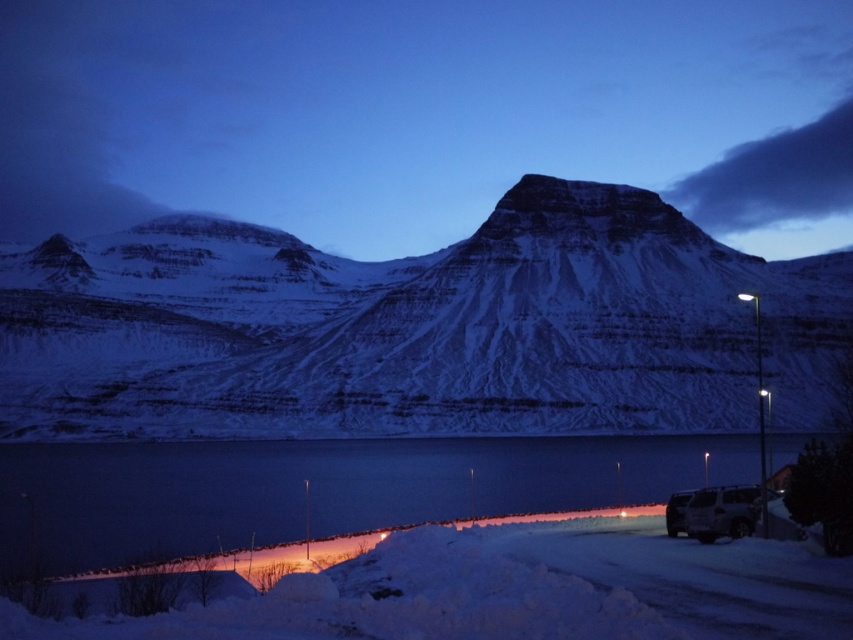
Is smooth ice lake at lower center further to the viewer compared to silver metallic van at lower right?

No, smooth ice lake at lower center is closer to the viewer.

Which is above, smooth ice lake at lower center or silver metallic van at lower right?

Positioned higher is smooth ice lake at lower center.

Who is more forward, [653,476] or [751,529]?

Point [751,529] is in front.

Locate an element on the screen. smooth ice lake at lower center is located at coordinates (318, 486).

Is snowy mountain at center wider than white powdery snow at lower center?

Yes.

Between snowy mountain at center and white powdery snow at lower center, which one is positioned lower?

Positioned lower is white powdery snow at lower center.

Identify the location of snowy mountain at center. (424, 115).

Identify the location of snowy mountain at center. The width and height of the screenshot is (853, 640). (424, 115).

Is white snow-covered mountain at center to the right of white powdery snow at lower center from the viewer's perspective?

No, white snow-covered mountain at center is not to the right of white powdery snow at lower center.

Between point (477, 349) and point (543, 532), which one is positioned in front?

Point (543, 532) is more forward.

The width and height of the screenshot is (853, 640). Describe the element at coordinates (415, 328) in the screenshot. I see `white snow-covered mountain at center` at that location.

The image size is (853, 640). I want to click on white snow-covered mountain at center, so click(415, 328).